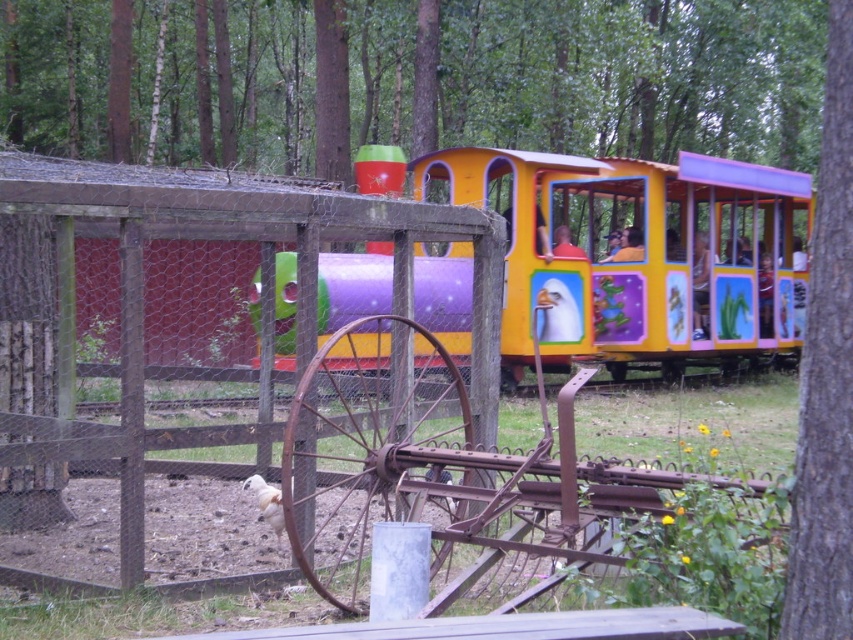
Question: Is matte plastic train at center closer to the viewer compared to green leafy tree at right?

Choices:
 (A) no
 (B) yes

Answer: (A)

Question: Does matte plastic train at center appear on the right side of green leafy tree at right?

Choices:
 (A) no
 (B) yes

Answer: (B)

Question: Which of the following is the farthest from the observer?

Choices:
 (A) (451, 349)
 (B) (819, 369)

Answer: (A)

Question: Does matte plastic train at center have a greater width compared to green leafy tree at right?

Choices:
 (A) no
 (B) yes

Answer: (B)

Question: Which point appears closest to the camera in this image?

Choices:
 (A) (726, 323)
 (B) (811, 424)

Answer: (B)